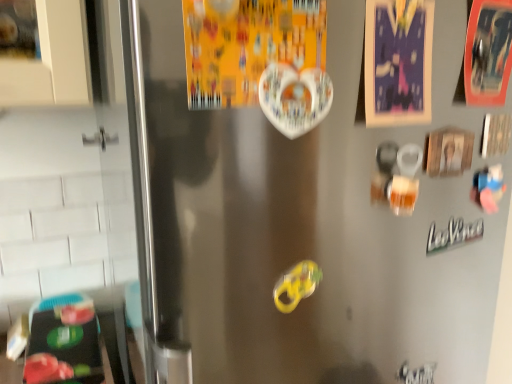
Question: Does yellow rubber band at center appear on the right side of white glossy heart at upper center, which is the third postcard in right-to-left order?

Choices:
 (A) yes
 (B) no

Answer: (A)

Question: Is yellow rubber band at center smaller than white glossy heart at upper center, marked as the first postcard in a left-to-right arrangement?

Choices:
 (A) yes
 (B) no

Answer: (A)

Question: Are yellow rubber band at center and white glossy heart at upper center, which is the third postcard in right-to-left order, far apart?

Choices:
 (A) yes
 (B) no

Answer: (B)

Question: Is yellow rubber band at center positioned with its back to white glossy heart at upper center, which is the third postcard in right-to-left order?

Choices:
 (A) no
 (B) yes

Answer: (A)

Question: From a real-world perspective, is yellow rubber band at center beneath white glossy heart at upper center, marked as the first postcard in a left-to-right arrangement?

Choices:
 (A) yes
 (B) no

Answer: (A)

Question: Is point (199, 84) closer or farther from the camera than point (292, 276)?

Choices:
 (A) closer
 (B) farther

Answer: (A)

Question: From a real-world perspective, is white glossy heart at upper center, which is the third postcard in right-to-left order, above or below yellow rubber band at center?

Choices:
 (A) above
 (B) below

Answer: (A)

Question: Considering the positions of white glossy heart at upper center, marked as the first postcard in a left-to-right arrangement, and yellow rubber band at center in the image, is white glossy heart at upper center, marked as the first postcard in a left-to-right arrangement, wider or thinner than yellow rubber band at center?

Choices:
 (A) wide
 (B) thin

Answer: (A)

Question: Looking at the image, does white glossy heart at upper center, marked as the first postcard in a left-to-right arrangement, seem bigger or smaller compared to yellow rubber band at center?

Choices:
 (A) big
 (B) small

Answer: (A)

Question: Is matte paper postcard at upper right, which is the 2th postcard in left-to-right order, spatially inside yellow rubber band at center, or outside of it?

Choices:
 (A) inside
 (B) outside

Answer: (B)

Question: Relative to yellow rubber band at center, is matte paper postcard at upper right, which is the 2th postcard in left-to-right order, in front or behind?

Choices:
 (A) front
 (B) behind

Answer: (A)

Question: From the image's perspective, relative to yellow rubber band at center, is matte paper postcard at upper right, placed as the 2th postcard when sorted from right to left, above or below?

Choices:
 (A) below
 (B) above

Answer: (B)

Question: Is matte paper postcard at upper right, placed as the 2th postcard when sorted from right to left, taller or shorter than yellow rubber band at center?

Choices:
 (A) short
 (B) tall

Answer: (B)

Question: From a real-world perspective, is orange cardboard postcard at upper right, the 1th postcard in the right-to-left sequence, physically located above or below matte paper postcard at upper right, placed as the 2th postcard when sorted from right to left?

Choices:
 (A) above
 (B) below

Answer: (A)

Question: Is orange cardboard postcard at upper right, which is the 3th postcard from left to right, wider or thinner than matte paper postcard at upper right, placed as the 2th postcard when sorted from right to left?

Choices:
 (A) thin
 (B) wide

Answer: (B)